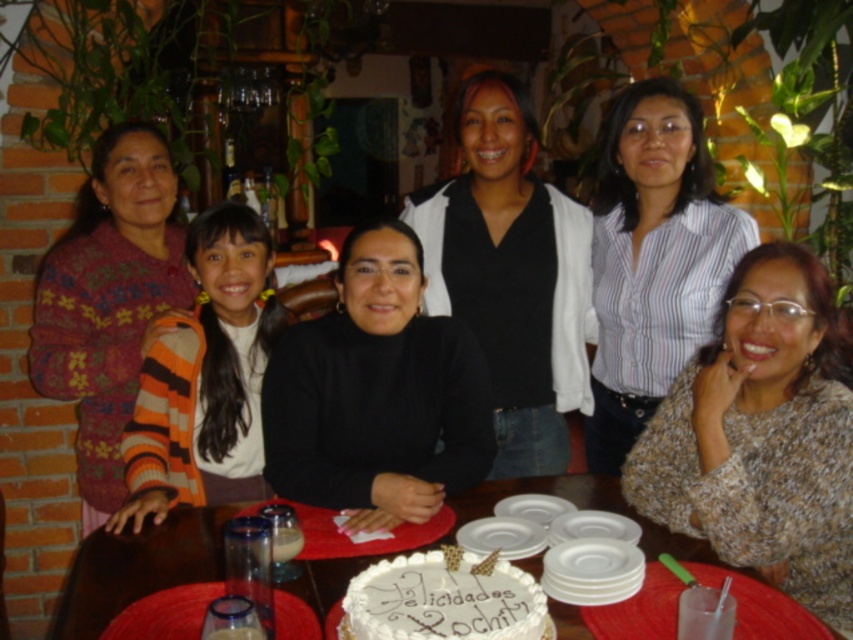
You are a photographer at the event and want to capture both the orange striped sweater at center and the white frosted cake at center in the same frame. Which object should you focus on first to ensure both are in the frame?

The orange striped sweater at center is thinner than the white frosted cake at center, so you should focus on the white frosted cake at center first to ensure both are in the frame.